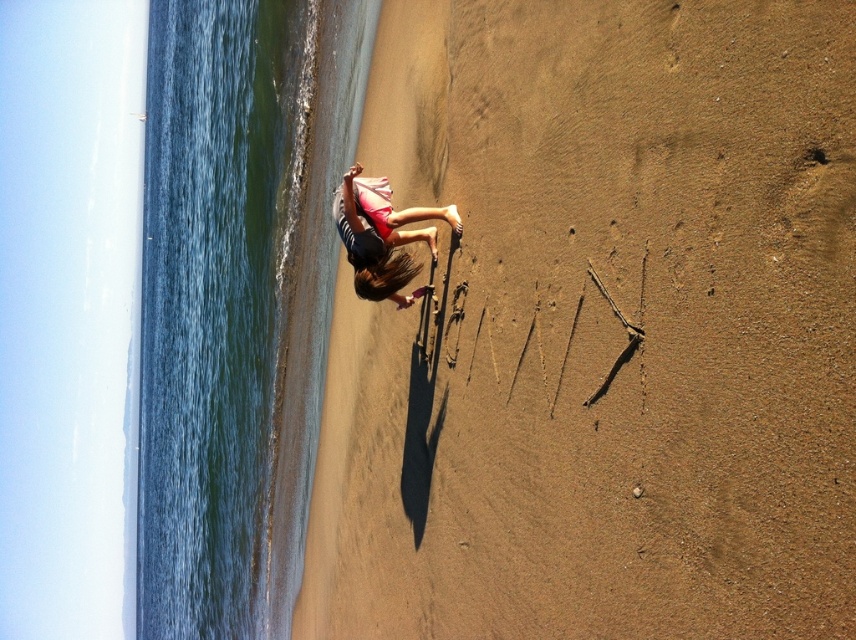
Question: Is blue water at left further to the viewer compared to matte pink shorts at center?

Choices:
 (A) no
 (B) yes

Answer: (B)

Question: Which object is closer to the camera taking this photo?

Choices:
 (A) blue water at left
 (B) matte pink shorts at center

Answer: (B)

Question: Which point is closer to the camera?

Choices:
 (A) (367, 204)
 (B) (735, 168)

Answer: (B)

Question: Considering the real-world distances, which object is closest to the brown sandy beach at lower right?

Choices:
 (A) matte pink shorts at center
 (B) blue water at left

Answer: (A)

Question: Does brown sandy beach at lower right lie in front of matte pink shorts at center?

Choices:
 (A) no
 (B) yes

Answer: (B)

Question: Is the position of brown sandy beach at lower right less distant than that of blue water at left?

Choices:
 (A) no
 (B) yes

Answer: (B)